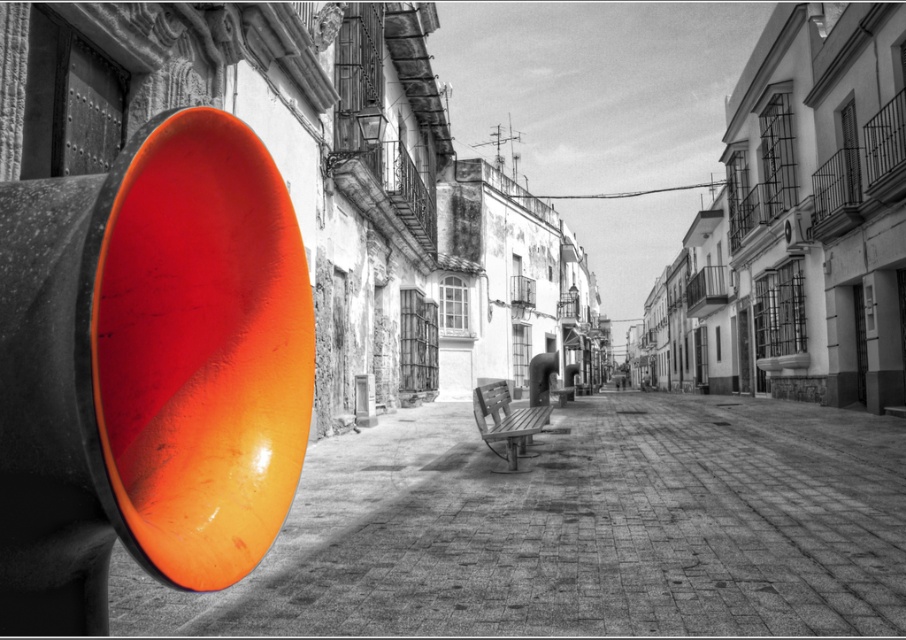
Does glossy orange disc at left have a greater width compared to wooden bench at center?

Yes.

Does glossy orange disc at left have a lesser width compared to wooden bench at center?

No.

This screenshot has width=906, height=640. In order to click on glossy orange disc at left in this screenshot , I will do `click(577, 529)`.

The width and height of the screenshot is (906, 640). What are the coordinates of `glossy orange traffic light at left` in the screenshot? It's located at (148, 369).

Is glossy orange traffic light at left taller than wooden bench at center?

Correct, glossy orange traffic light at left is much taller as wooden bench at center.

Is point (61, 230) in front of point (522, 410)?

Yes, point (61, 230) is closer to viewer.

At what (x,y) coordinates should I click in order to perform the action: click on glossy orange traffic light at left. Please return your answer as a coordinate pair (x, y). Image resolution: width=906 pixels, height=640 pixels. Looking at the image, I should click on (148, 369).

Is point (278, 614) farther from viewer compared to point (255, 483)?

Yes.

Does point (709, 580) lie behind point (278, 451)?

That is True.

Where is `glossy orange disc at left`? The height and width of the screenshot is (640, 906). glossy orange disc at left is located at coordinates (577, 529).